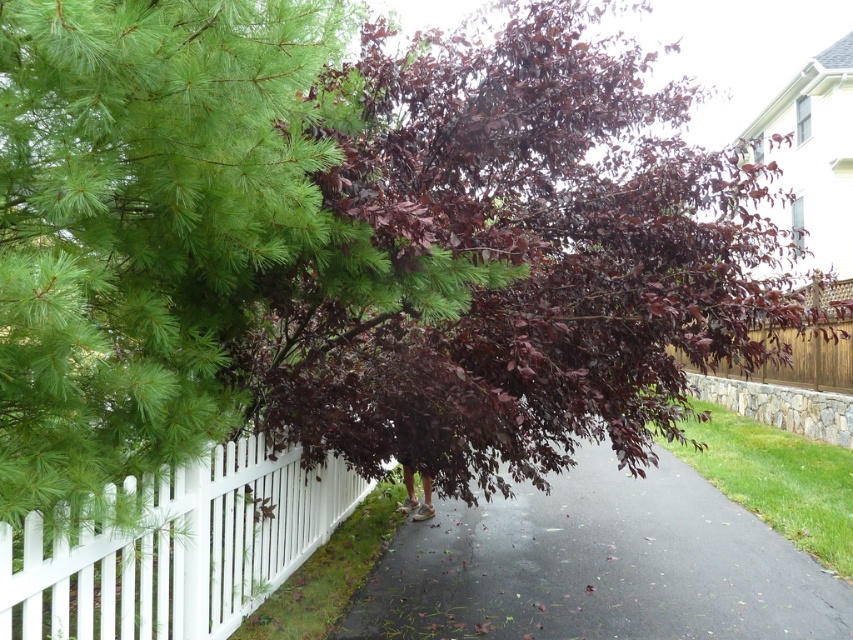
Can you confirm if dark purple leafy tree at center is positioned to the right of white wooden fence at center?

Indeed, dark purple leafy tree at center is positioned on the right side of white wooden fence at center.

Which is more to the right, dark purple leafy tree at center or white wooden fence at center?

dark purple leafy tree at center is more to the right.

Between point (505, 211) and point (270, 513), which one is positioned behind?

The point (505, 211) is more distant.

Identify the location of dark purple leafy tree at center. (523, 257).

Is point (321, 381) positioned behind point (585, 540)?

No, it is in front of (585, 540).

Can you confirm if dark purple leafy tree at center is positioned to the right of black asphalt pavement at center?

In fact, dark purple leafy tree at center is to the left of black asphalt pavement at center.

Does point (699, 172) come farther from viewer compared to point (561, 620)?

No, it is not.

You are a GUI agent. You are given a task and a screenshot of the screen. Output one action in this format:
    pyautogui.click(x=<x>, y=<y>)
    Task: Click on the dark purple leafy tree at center
    This screenshot has width=853, height=640.
    Given the screenshot: What is the action you would take?
    pyautogui.click(x=523, y=257)

Who is shorter, black asphalt pavement at center or white wooden fence at center?

Standing shorter between the two is black asphalt pavement at center.

Can you confirm if black asphalt pavement at center is positioned to the right of white wooden fence at center?

Indeed, black asphalt pavement at center is positioned on the right side of white wooden fence at center.

The image size is (853, 640). Identify the location of black asphalt pavement at center. (599, 566).